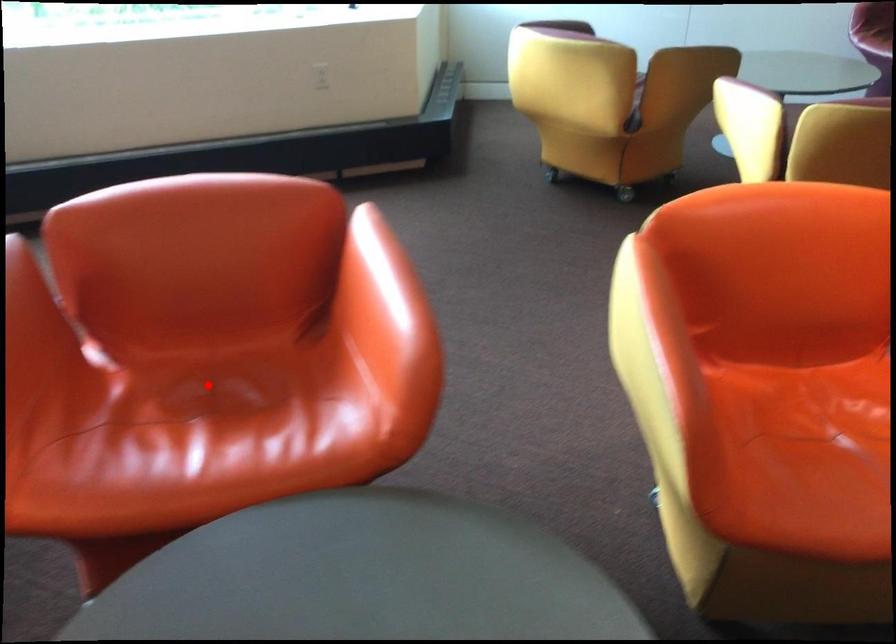
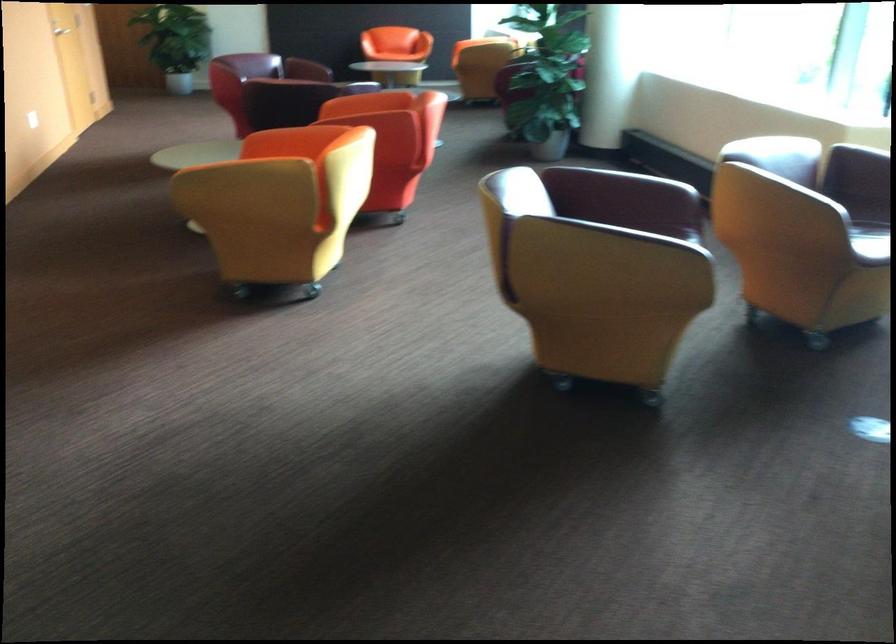
Question: I am providing you with two images of the same scene from different viewpoints. A red point is marked on the first image. At the location where the point appears in image 1, is it still visible in image 2?

Choices:
 (A) Yes
 (B) No

Answer: (B)